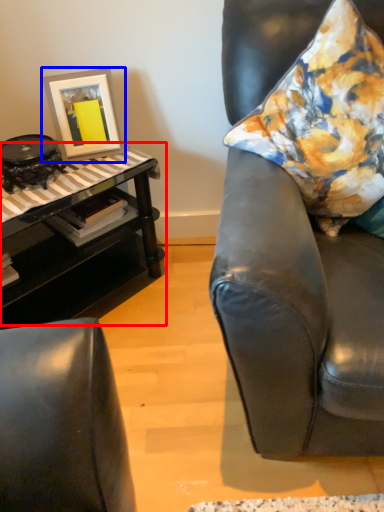
Question: Which object is closer to the camera taking this photo, table (highlighted by a red box) or picture frame (highlighted by a blue box)?

Choices:
 (A) table
 (B) picture frame

Answer: (A)